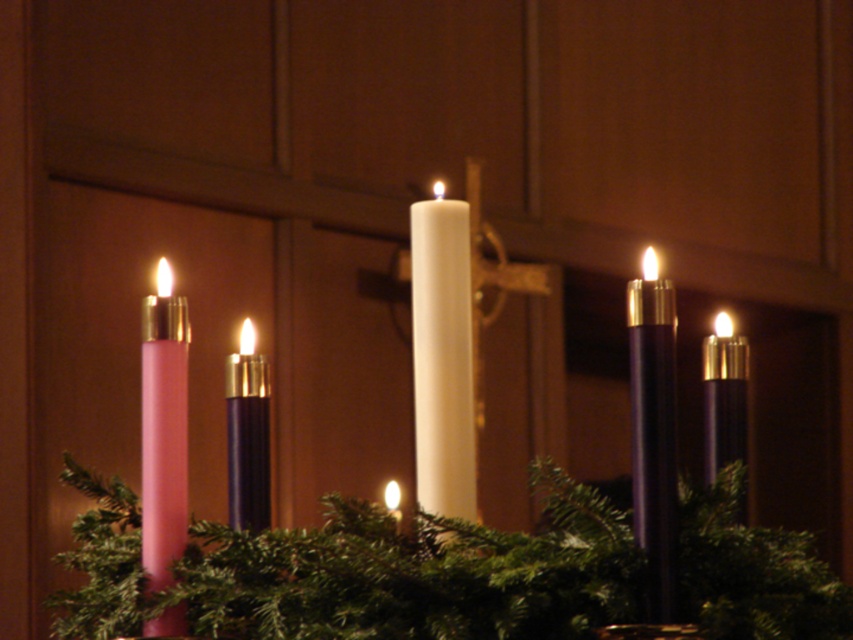
Question: Where is matte black candle at right located in relation to purple matte candle at center in the image?

Choices:
 (A) above
 (B) below

Answer: (A)

Question: Which point is farther to the camera?

Choices:
 (A) (422, 422)
 (B) (717, 428)
 (C) (248, 445)

Answer: (B)

Question: Can you confirm if white matte candle at center is positioned above matte purple candle at right?

Choices:
 (A) yes
 (B) no

Answer: (A)

Question: Does pink matte candle at left come behind matte purple candle at right?

Choices:
 (A) yes
 (B) no

Answer: (B)

Question: Which is nearer to the matte purple candle at right?

Choices:
 (A) pink matte candle at left
 (B) purple matte candle at center
 (C) matte black candle at right

Answer: (C)

Question: Among these points, which one is farthest from the camera?

Choices:
 (A) (167, 266)
 (B) (724, 330)

Answer: (A)